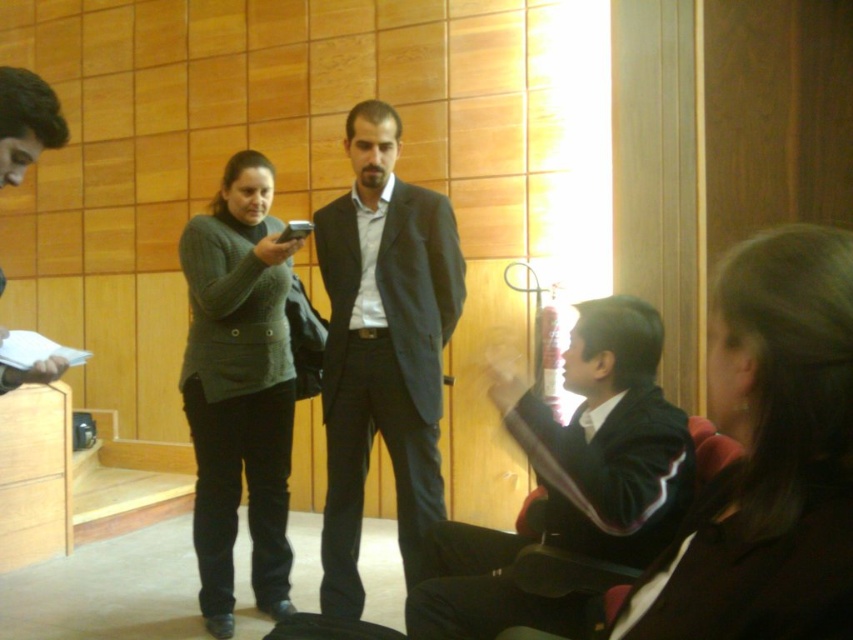
Is point (401, 202) positioned after point (636, 467)?

Yes.

Does dark gray suit at center appear over black matte jacket at lower right?

Yes, dark gray suit at center is above black matte jacket at lower right.

Is point (326, 381) less distant than point (640, 413)?

No, (326, 381) is further to viewer.

I want to click on dark gray suit at center, so click(x=381, y=348).

Can you confirm if black matte jacket at lower right is positioned to the right of matte black jacket at left?

Indeed, black matte jacket at lower right is positioned on the right side of matte black jacket at left.

Looking at this image, which of these two, black matte jacket at lower right or matte black jacket at left, stands taller?

Standing taller between the two is matte black jacket at left.

Image resolution: width=853 pixels, height=640 pixels. Identify the location of black matte jacket at lower right. (605, 436).

Can you confirm if dark brown hair at lower right is positioned to the left of matte black jacket at left?

In fact, dark brown hair at lower right is to the right of matte black jacket at left.

Describe the element at coordinates (769, 456) in the screenshot. I see `dark brown hair at lower right` at that location.

This screenshot has width=853, height=640. In order to click on dark brown hair at lower right in this screenshot , I will do `click(769, 456)`.

At what (x,y) coordinates should I click in order to perform the action: click on dark brown hair at lower right. Please return your answer as a coordinate pair (x, y). Looking at the image, I should click on (769, 456).